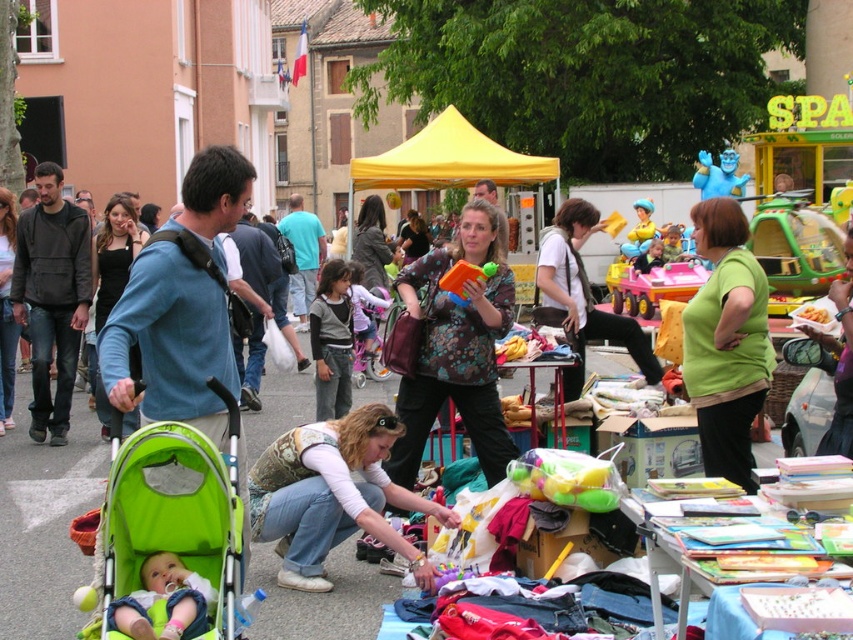
You are standing at the point labeled point (744, 310) and want to move to the point labeled point (368, 202). Given that you can only move forward in a straight line, will you be able to reach the second point without changing direction?

Yes, because point (744, 310) is closer to the viewer than point (368, 202), so moving forward in a straight line will take you towards the latter point.

You are a photographer trying to capture a photo of both the denim pants at lower center and the soft green fabric stroller at lower left. Since you can only focus on one object at a time, which object should you focus on to ensure the other is still in the background?

You should focus on the denim pants at lower center because it is positioned on the right side of the soft green fabric stroller at lower left, so the stroller will be in the background.